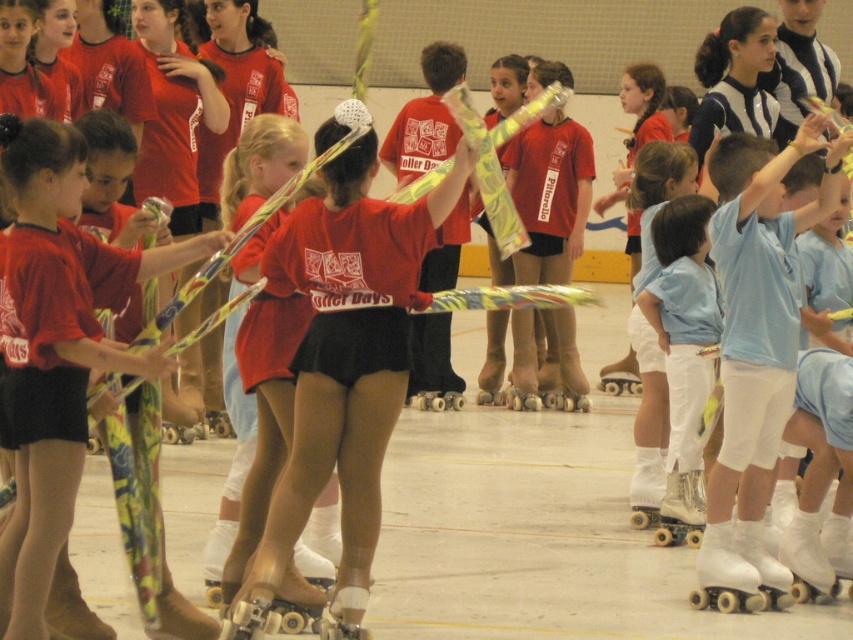
Question: Which point is closer to the camera?

Choices:
 (A) (712, 563)
 (B) (773, 244)

Answer: (B)

Question: Does white matte shorts at right appear over white rubber roller skate at lower right?

Choices:
 (A) yes
 (B) no

Answer: (A)

Question: Can you confirm if white matte shorts at right is positioned below white rubber roller skate at lower right?

Choices:
 (A) no
 (B) yes

Answer: (A)

Question: Which object appears closest to the camera in this image?

Choices:
 (A) white rubber roller skate at lower right
 (B) white matte shorts at right

Answer: (B)

Question: Which point appears farthest from the camera in this image?

Choices:
 (A) (726, 410)
 (B) (711, 561)

Answer: (A)

Question: Is the position of white matte shorts at right more distant than that of white rubber roller skate at lower right?

Choices:
 (A) yes
 (B) no

Answer: (B)